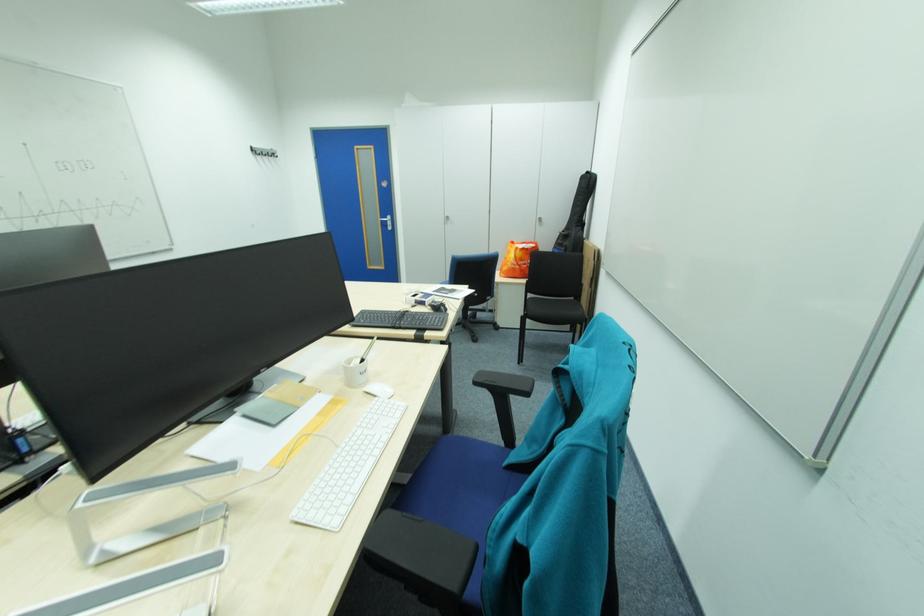
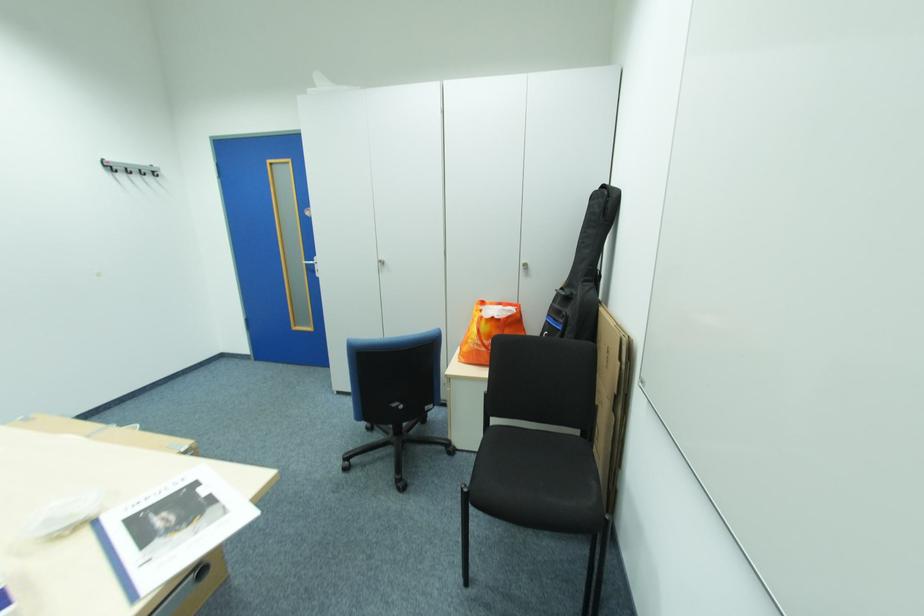
Locate, in the second image, the point that corresponds to point (517, 265) in the first image.

(480, 345)